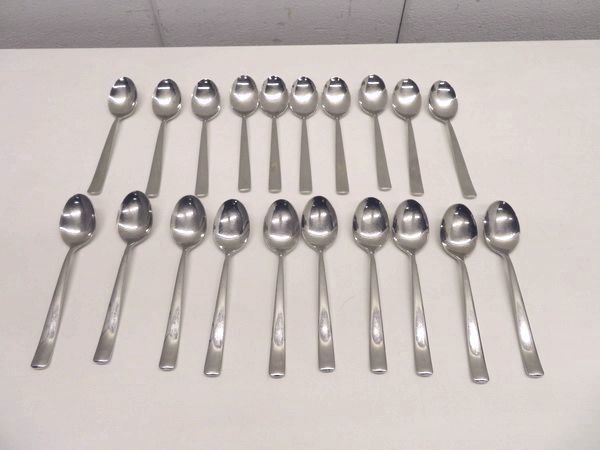
Where is `spoons on the bottom row`? This screenshot has width=600, height=450. spoons on the bottom row is located at coordinates (78, 232), (132, 223), (186, 230), (237, 230), (288, 230), (324, 226), (379, 222), (414, 226), (465, 227), (488, 227).